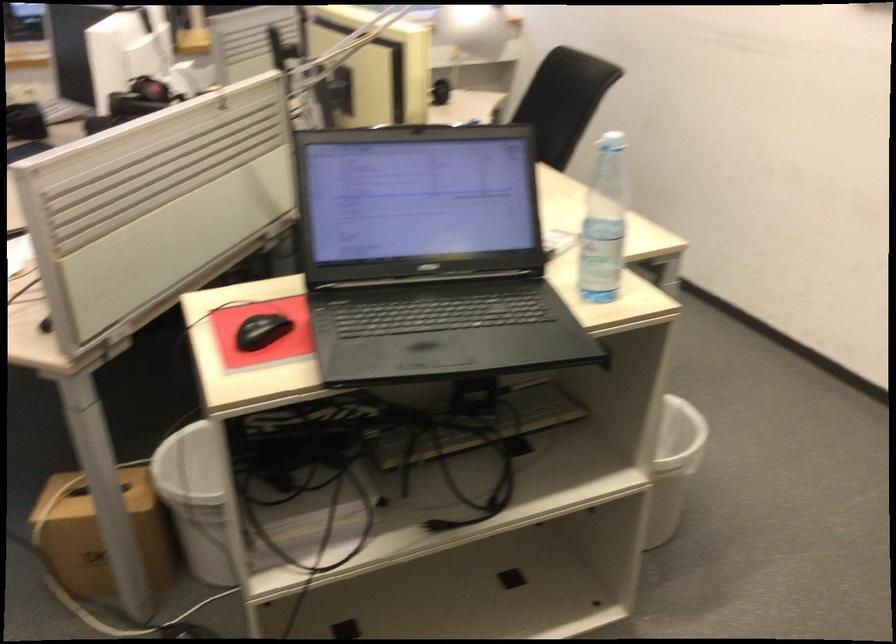
What do you see at coordinates (612, 142) in the screenshot? Image resolution: width=896 pixels, height=644 pixels. I see `the white bottle cap` at bounding box center [612, 142].